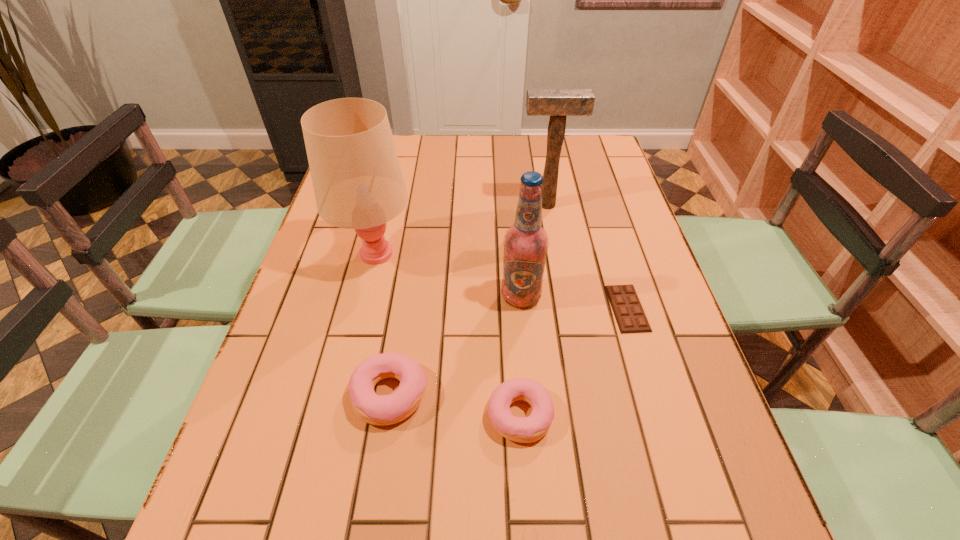
The image size is (960, 540). I want to click on empty location between the mallet and the shorter doughnut, so click(533, 309).

What are the coordinates of `free space between the left doughnut and the farthest object` in the screenshot? It's located at (468, 299).

The height and width of the screenshot is (540, 960). Find the location of `free spot between the lampshade and the farthest object`. free spot between the lampshade and the farthest object is located at coordinates (461, 230).

Select which object is the fifth closest to the right doughnut. Please provide its 2D coordinates. Your answer should be formatted as a tuple, i.e. [(x, y)], where the tuple contains the x and y coordinates of a point satisfying the conditions above.

[(557, 103)]

Identify which object is located as the fifth nearest to the lampshade. Please provide its 2D coordinates. Your answer should be formatted as a tuple, i.e. [(x, y)], where the tuple contains the x and y coordinates of a point satisfying the conditions above.

[(629, 314)]

Identify the location of vacant area in the image that satisfies the following two spatial constraints: 1. on the front side of the alcohol; 2. on the left side of the rightmost object. (522, 308).

This screenshot has height=540, width=960. What are the coordinates of `vacant area in the image that satisfies the following two spatial constraints: 1. on the front side of the lampshade; 2. on the left side of the alcohol` in the screenshot? It's located at pos(366,296).